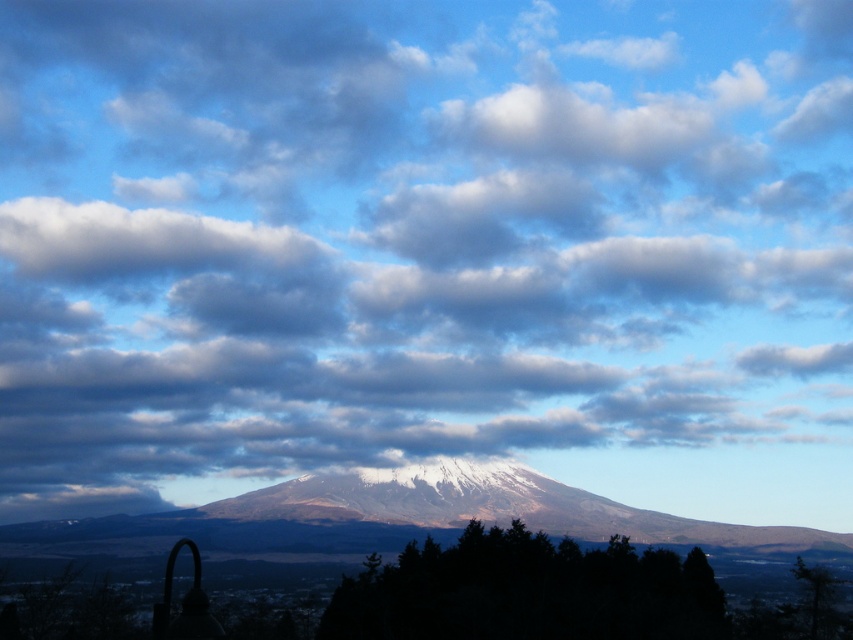
You are an astronomer analyzing the image. You see a point at coordinates (416, 513). What does this point represent in the scene?

The point at coordinates (416, 513) corresponds to the white snow covered mountain at center.